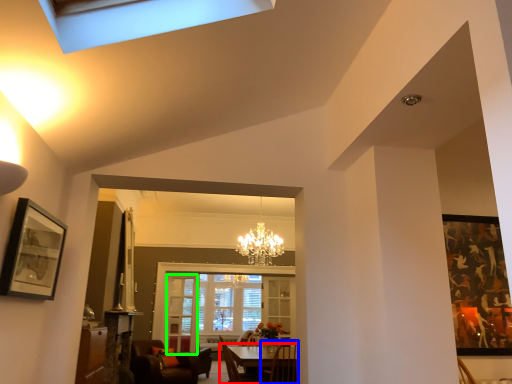
Question: Based on their relative distances, which object is farther from table (highlighted by a red box)? Choose from chair (highlighted by a blue box) and glass door (highlighted by a green box).

Choices:
 (A) chair
 (B) glass door

Answer: (B)